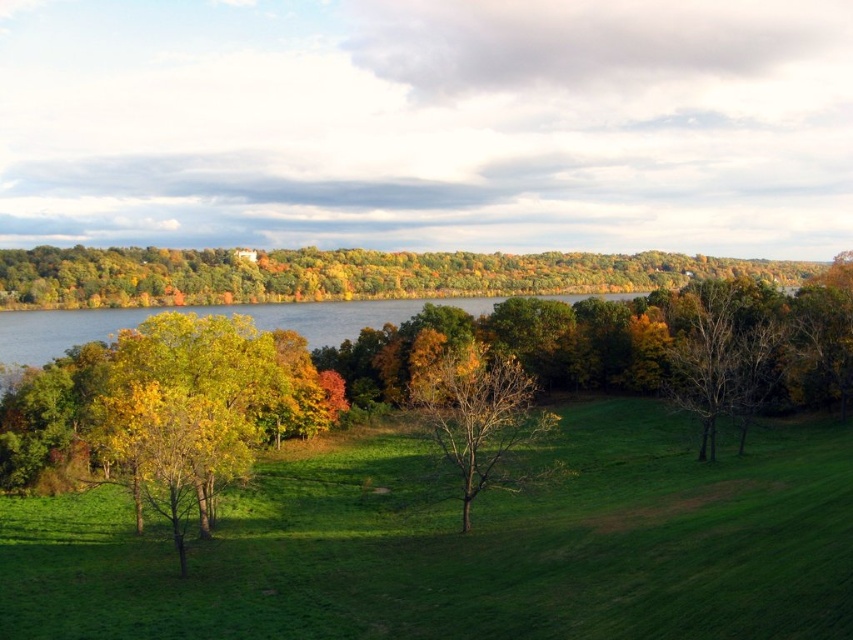
You are standing in the autumn field and see the bare branches at center right and the green water at center. Which object is closer to the ground?

The bare branches at center right is located below green water at center, so it is closer to the ground.

You are standing at the center of the field and want to walk directly towards the brown leafless tree at center. Given your current position is at coordinates point 0.5, 0.5, will you need to adjust your direction to reach the tree?

The brown leafless tree at center is located at point (x=479, y=417), so you need to adjust your direction slightly to the right and forward to reach it since your current position is at (x=426, y=320).

You are standing in the autumn landscape and want to take a photo of the green leafy tree at upper center and the green water at center. Which object is located to the right of the other?

The green leafy tree at upper center is positioned on the right side of green water at center.